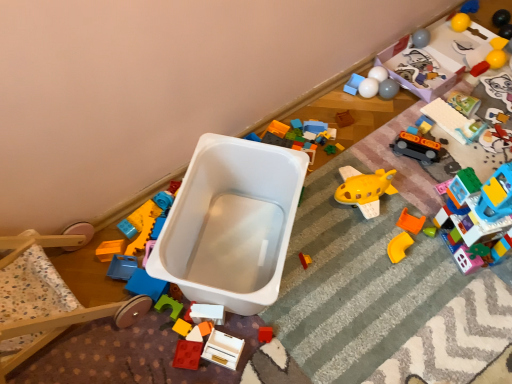
You are a GUI agent. You are given a task and a screenshot of the screen. Output one action in this format:
    pyautogui.click(x=<x>, y=<y>)
    Task: Click on the free area in between orange matte plastic corner piece at lower right, the ninth toy positioned from the right, and rubberized plastic block at center, the 1th toy positioned from the left
    This screenshot has width=512, height=384.
    Given the screenshot: What is the action you would take?
    pos(329,275)